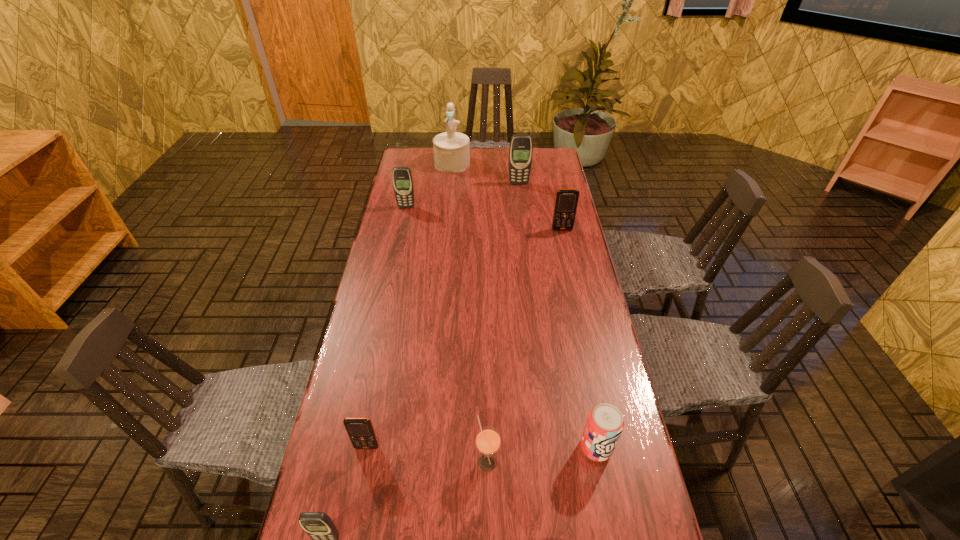
Where is `the left orange cellular telephone`? This screenshot has width=960, height=540. the left orange cellular telephone is located at coordinates (361, 432).

This screenshot has height=540, width=960. In order to click on the nearer orange cellular telephone in this screenshot , I will do `click(361, 432)`.

At what (x,y) coordinates should I click in order to perform the action: click on free spot located 0.050m at the beak of the fourth object from left to right. Please return your answer as a coordinate pair (x, y). This screenshot has height=540, width=960. Looking at the image, I should click on (451, 179).

Locate an element on the screen. This screenshot has height=540, width=960. vacant space located 0.380m on the screen of the tallest cellular telephone is located at coordinates (525, 240).

I want to click on vacant space located on the screen of the second nearest gray cellular telephone, so click(x=394, y=267).

In order to click on free space located on the screen of the rightmost cellular telephone in this screenshot , I will do `click(571, 271)`.

The image size is (960, 540). What are the coordinates of `vacant space located 0.110m on the front of the fifth object from left to right` in the screenshot? It's located at (489, 526).

Locate an element on the screen. This screenshot has height=540, width=960. vacant space located on the left of the soda can is located at coordinates 431,448.

In order to click on vacant space located on the screen of the nearer orange cellular telephone in this screenshot , I will do `click(352, 522)`.

Where is `object at the far edge`? object at the far edge is located at coordinates (451, 149).